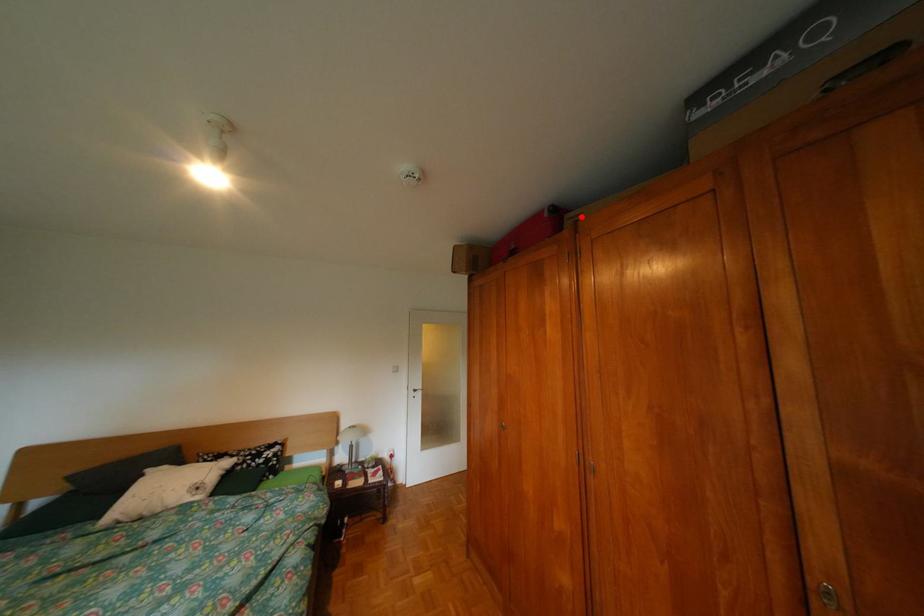
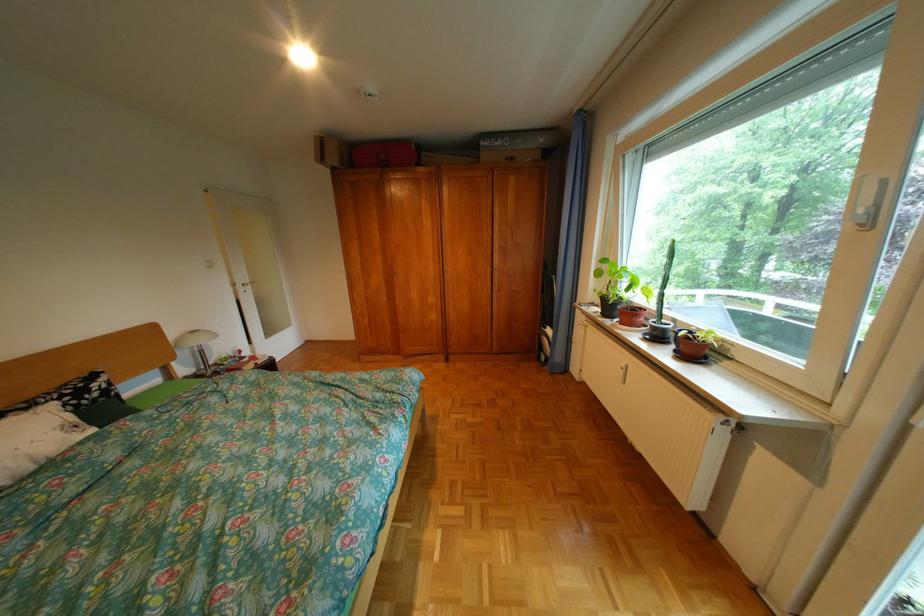
Question: A red point is marked in image1. In image2, is the corresponding 3D point closer to the camera or farther? Reply with the corresponding letter.

Choices:
 (A) The corresponding 3D point is closer.
 (B) The corresponding 3D point is farther.

Answer: (A)